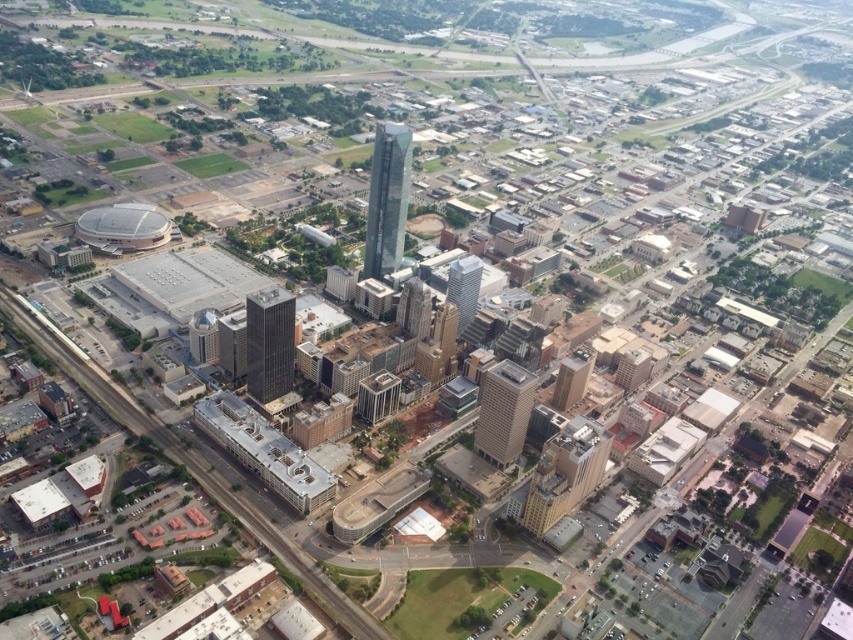
Is gray concrete skyscraper at center to the left of glassy silver skyscraper at center from the viewer's perspective?

No, gray concrete skyscraper at center is not to the left of glassy silver skyscraper at center.

Can you confirm if gray concrete skyscraper at center is positioned below glassy silver skyscraper at center?

Yes, gray concrete skyscraper at center is below glassy silver skyscraper at center.

Describe the element at coordinates (503, 412) in the screenshot. I see `gray concrete skyscraper at center` at that location.

The width and height of the screenshot is (853, 640). What are the coordinates of `gray concrete skyscraper at center` in the screenshot? It's located at (503, 412).

Looking at this image, can you confirm if shiny glass skyscraper at center is bigger than glassy silver skyscraper at center?

Indeed, shiny glass skyscraper at center has a larger size compared to glassy silver skyscraper at center.

Who is more forward, [370,198] or [473,268]?

Positioned in front is point [473,268].

The width and height of the screenshot is (853, 640). In order to click on shiny glass skyscraper at center in this screenshot , I will do `click(387, 198)`.

Who is more forward, (x=381, y=237) or (x=289, y=336)?

Point (x=289, y=336)

Can you confirm if shiny glass skyscraper at center is shorter than dark gray glass skyscraper at center?

No, shiny glass skyscraper at center is not shorter than dark gray glass skyscraper at center.

Who is more distant from viewer, (379, 244) or (254, 397)?

The point (379, 244) is behind.

At what (x,y) coordinates should I click in order to perform the action: click on shiny glass skyscraper at center. Please return your answer as a coordinate pair (x, y). This screenshot has height=640, width=853. Looking at the image, I should click on (387, 198).